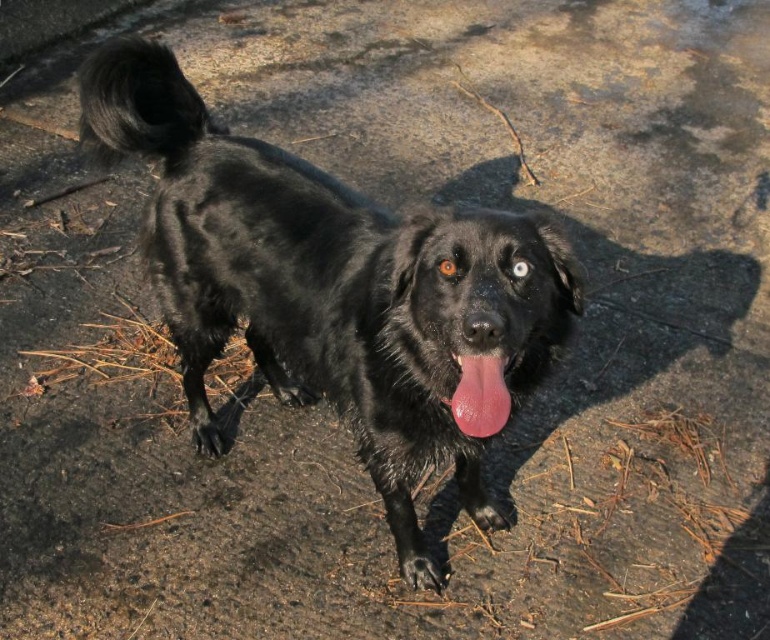
You are a photographer trying to capture the shiny black dog at center and its pink glossy tongue at center. Which object should you focus on first to ensure both are in sharp focus?

The shiny black dog at center is closer to the viewer than the pink glossy tongue at center. To ensure both are in sharp focus, you should focus on the shiny black dog at center first, as it is the closer object.

You are a photographer trying to capture the black dog. You notice two points marked in the image at coordinates point (363, 365) and point (490, 394). Which point is closer to you?

Point (363, 365) is closer to you because it is further to the viewer than point (490, 394).

You are a photographer trying to capture a closeup of the shiny black dog at center and the pink glossy tongue at center. Since you want to focus on both, which object should you ensure is in focus first?

The shiny black dog at center is bigger than the pink glossy tongue at center, so you should focus on the shiny black dog at center first to ensure both are in focus.